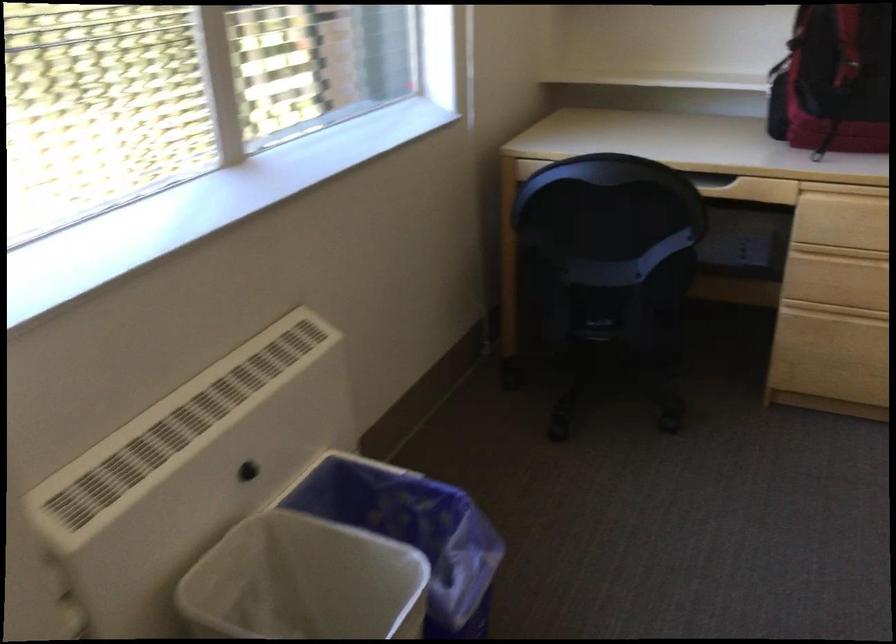
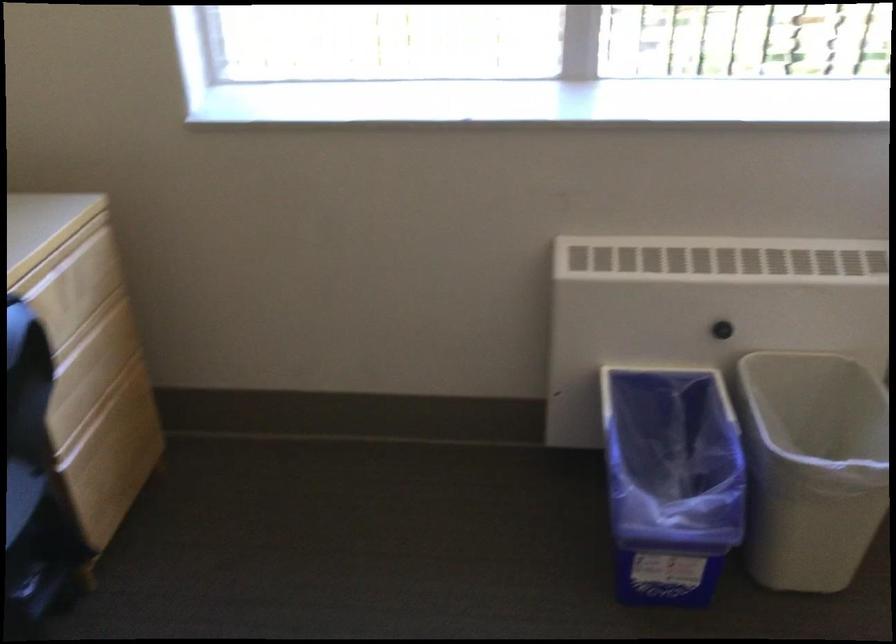
The first image is from the beginning of the video and the second image is from the end. How did the camera likely rotate when shooting the video?

The rotation direction of the camera is left-down.